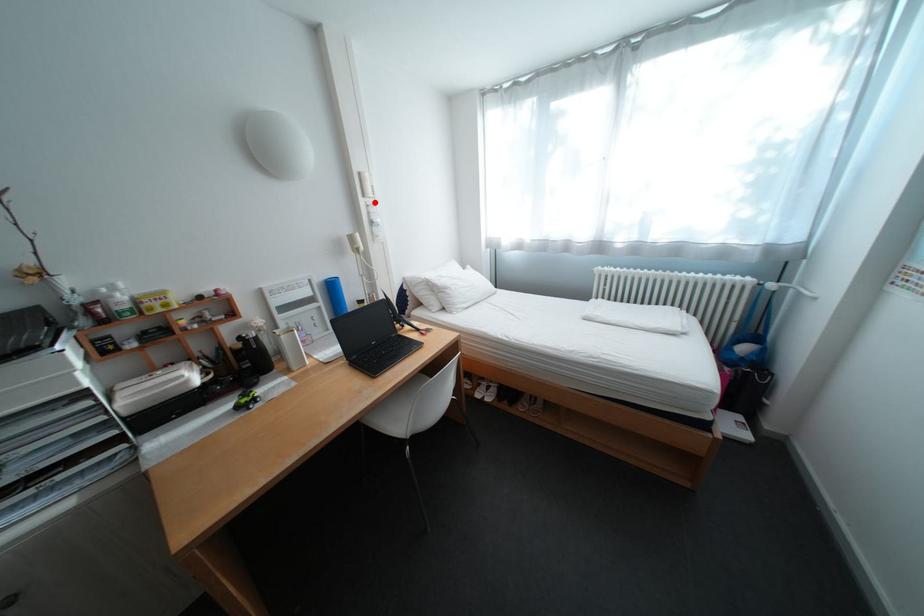
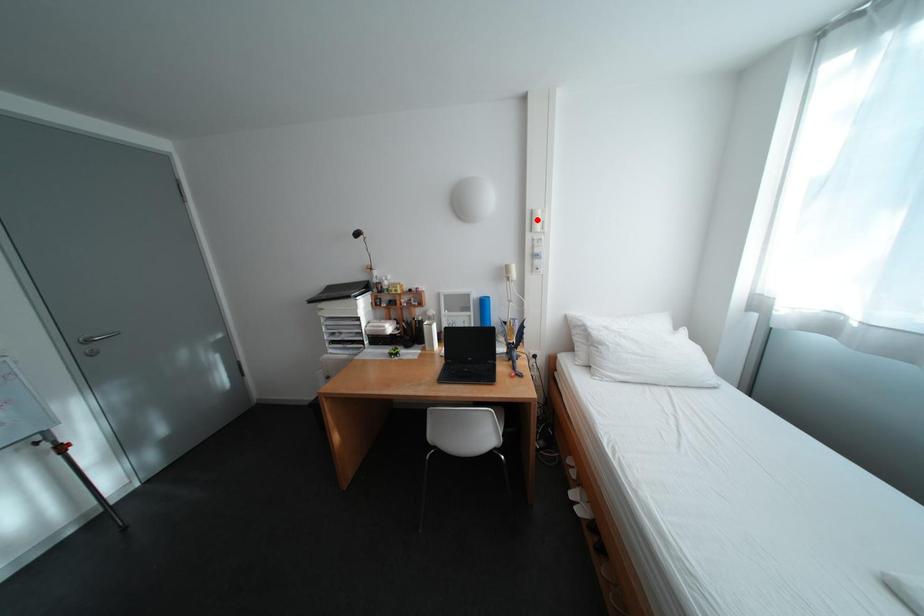
I am providing you with two images of the same scene from different viewpoints. A red point is marked on the first image and another point is marked on the second image. Is the marked point in image1 the same physical position as the marked point in image2?

No